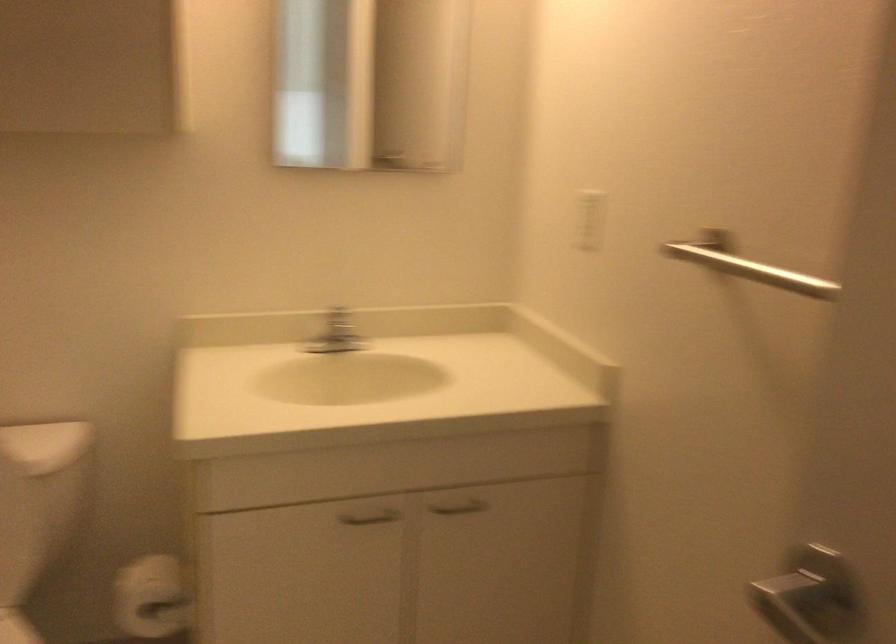
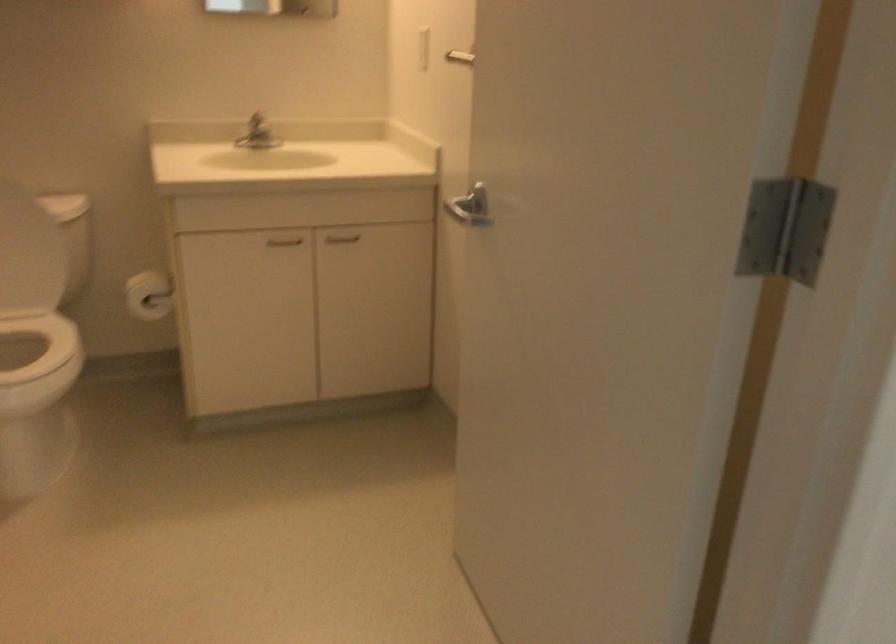
Where in the second image is the point corresponding to point 374,523 from the first image?

(283, 241)